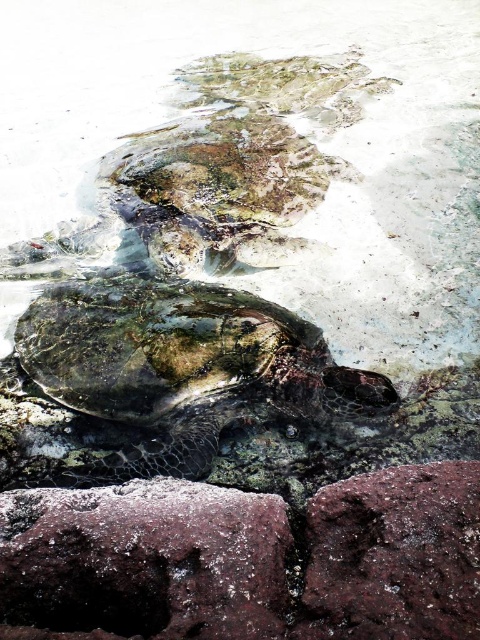
You are a photographer trying to capture both turtles in the image. You notice two points of interest marked as point (310, 324) and point (288, 150). Which point is closer to you?

Point (310, 324) is closer to the viewer than point (288, 150).